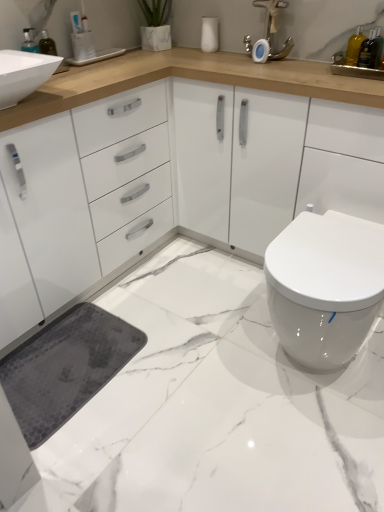
Question: Is translucent glass bottle at upper right, arranged as the second toiletry when viewed from the back, facing away from white glossy toilet at lower right?

Choices:
 (A) no
 (B) yes

Answer: (A)

Question: Is translucent glass bottle at upper right, the 1th toiletry positioned from the right, wider than white glossy toilet at lower right?

Choices:
 (A) yes
 (B) no

Answer: (B)

Question: Is translucent glass bottle at upper right, the second toiletry in the top-to-bottom sequence, positioned beyond the bounds of white glossy toilet at lower right?

Choices:
 (A) yes
 (B) no

Answer: (A)

Question: Does translucent glass bottle at upper right, the first toiletry in the front-to-back sequence, have a larger size compared to white glossy toilet at lower right?

Choices:
 (A) yes
 (B) no

Answer: (B)

Question: Considering the relative sizes of translucent glass bottle at upper right, acting as the 1th toiletry starting from the bottom, and white glossy toilet at lower right in the image provided, is translucent glass bottle at upper right, acting as the 1th toiletry starting from the bottom, thinner than white glossy toilet at lower right?

Choices:
 (A) no
 (B) yes

Answer: (B)

Question: Relative to matte silver faucet at upper center, is translucent glass bottle at upper right, arranged as the second toiletry when viewed from the back, in front or behind?

Choices:
 (A) front
 (B) behind

Answer: (A)

Question: Is point (359, 66) positioned closer to the camera than point (269, 4)?

Choices:
 (A) closer
 (B) farther

Answer: (A)

Question: Is translucent glass bottle at upper right, acting as the 1th toiletry starting from the bottom, bigger or smaller than matte silver faucet at upper center?

Choices:
 (A) small
 (B) big

Answer: (A)

Question: From a real-world perspective, is translucent glass bottle at upper right, the 1th toiletry positioned from the right, physically located above or below matte silver faucet at upper center?

Choices:
 (A) below
 (B) above

Answer: (A)

Question: Considering the positions of white glossy sink at upper left, the first sink in the left-to-right sequence, and translucent glass bottle at upper right, the first toiletry in the front-to-back sequence, in the image, is white glossy sink at upper left, the first sink in the left-to-right sequence, wider or thinner than translucent glass bottle at upper right, the first toiletry in the front-to-back sequence,?

Choices:
 (A) wide
 (B) thin

Answer: (A)

Question: Choose the correct answer: Is white glossy sink at upper left, the first sink in the left-to-right sequence, inside translucent glass bottle at upper right, the 1th toiletry positioned from the right, or outside it?

Choices:
 (A) outside
 (B) inside

Answer: (A)

Question: Is point (3, 72) positioned closer to the camera than point (369, 55)?

Choices:
 (A) closer
 (B) farther

Answer: (A)

Question: Is white glossy sink at upper left, the first sink in the left-to-right sequence, taller or shorter than translucent glass bottle at upper right, arranged as the second toiletry when viewed from the back?

Choices:
 (A) short
 (B) tall

Answer: (A)

Question: Visually, is blue plastic toothbrush at upper left, the first toiletry from the top, positioned to the left or to the right of white glossy toilet at lower right?

Choices:
 (A) left
 (B) right

Answer: (A)

Question: In terms of size, does blue plastic toothbrush at upper left, placed as the 1th toiletry when sorted from back to front, appear bigger or smaller than white glossy toilet at lower right?

Choices:
 (A) small
 (B) big

Answer: (A)